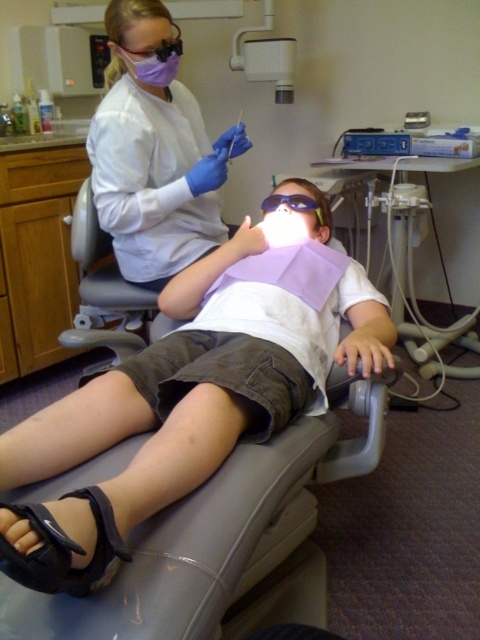
You are a dental assistant trying to locate the purple fabric mask at upper left in the image. According to the coordinates given, where exactly is it positioned?

The purple fabric mask at upper left is located at the 2D coordinates of point (146, 52).

What are the coordinates of the white matte bib at center?

The white matte bib at center is located at coordinates point (189, 397).

You are a dental assistant and need to place a new purple fabric mask at upper left on the tray next to the white matte bib at center. Which object should you move first to make space?

The purple fabric mask at upper left should be moved first because it is smaller than the white matte bib at center, which is wider and takes up more space.